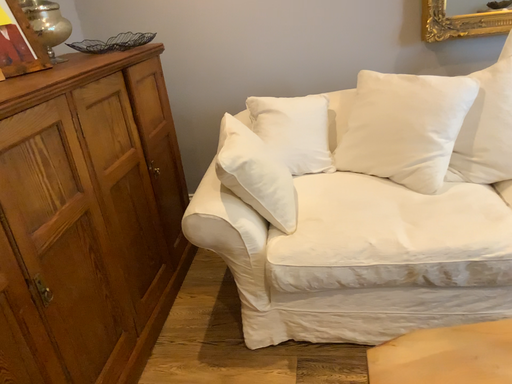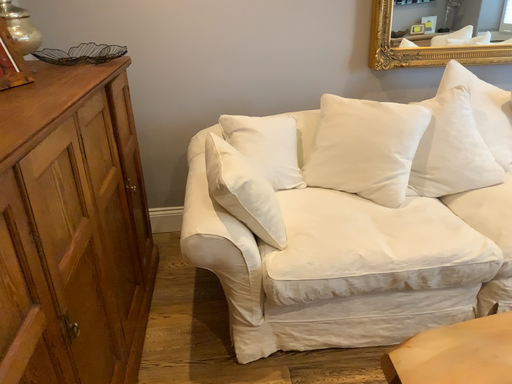
Question: Which way did the camera rotate in the video?

Choices:
 (A) rotated left
 (B) rotated right

Answer: (B)